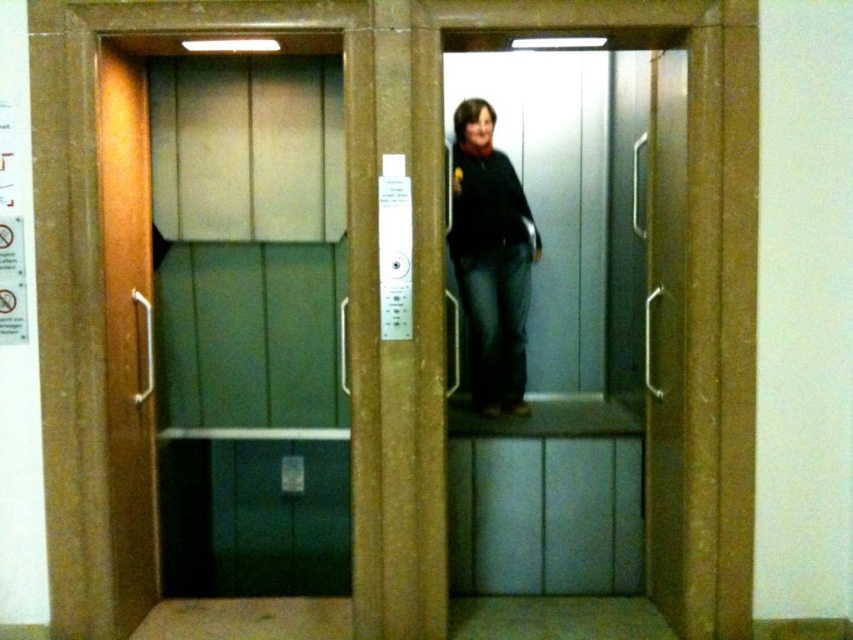
You are a delivery person carrying a package that is 5 feet long. You are standing in front of the wooden door at left and the matte black sweater at center. Can you fit the package horizontally between them?

The wooden door at left is 4.73 feet away from the matte black sweater at center. Since the package is 5 feet long, it is slightly longer than the distance between them, so it won not fit horizontally between the wooden door at left and the matte black sweater at center.

You are standing in front of two open elevator doors. There is a point marked at coordinates (126,332). Which elevator door is this point located on?

The point marked at coordinates (126,332) is on the wooden door at left.

You are a delivery person carrying a large package that requires a door width of at least 1 meter. You see the wooden door at left and the wooden elevator door at center. Which door should you choose to ensure your package can pass through?

The wooden door at left is larger in size than the wooden elevator door at center, so you should choose the wooden door at left to ensure your package can pass through.